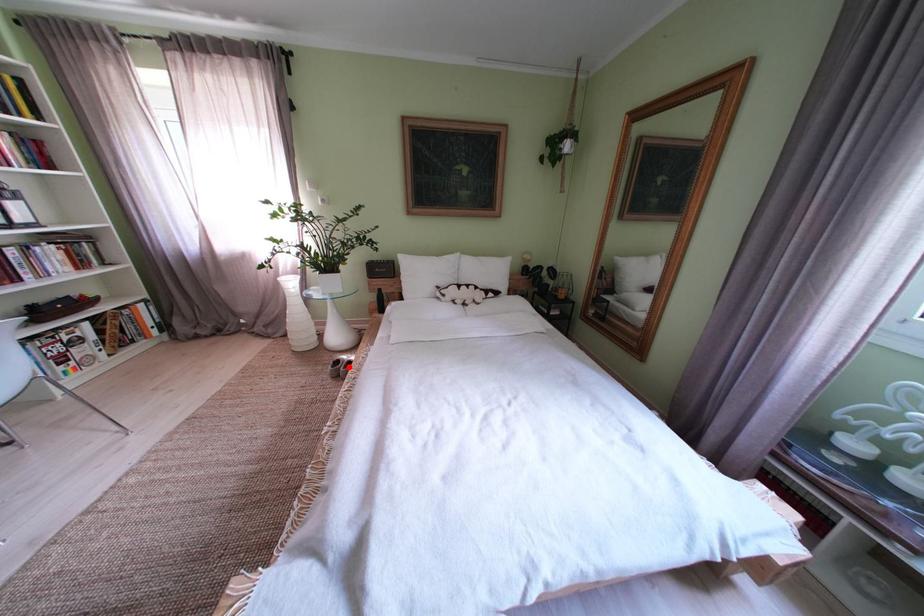
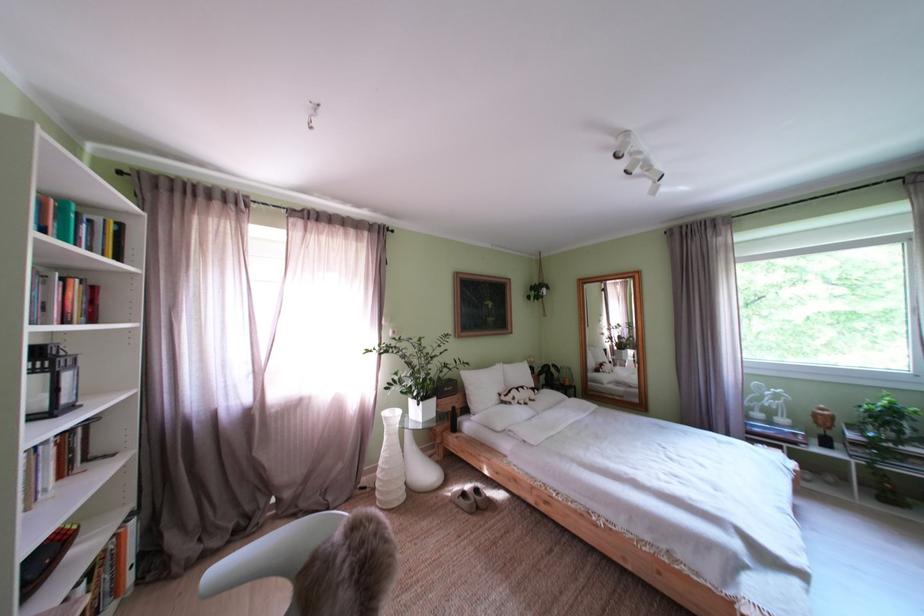
Where in the second image is the point corresponding to the highlighted location from the first image?

(475, 500)